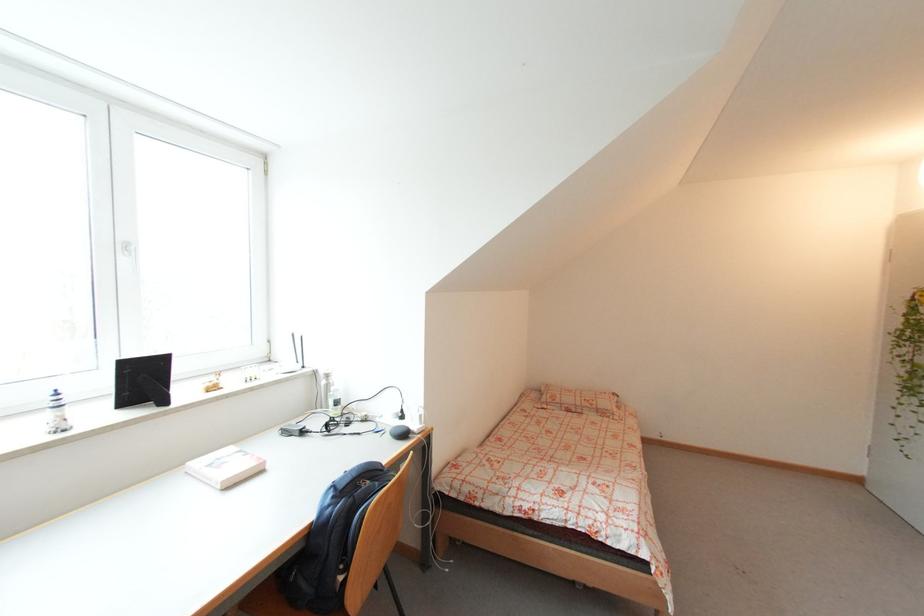
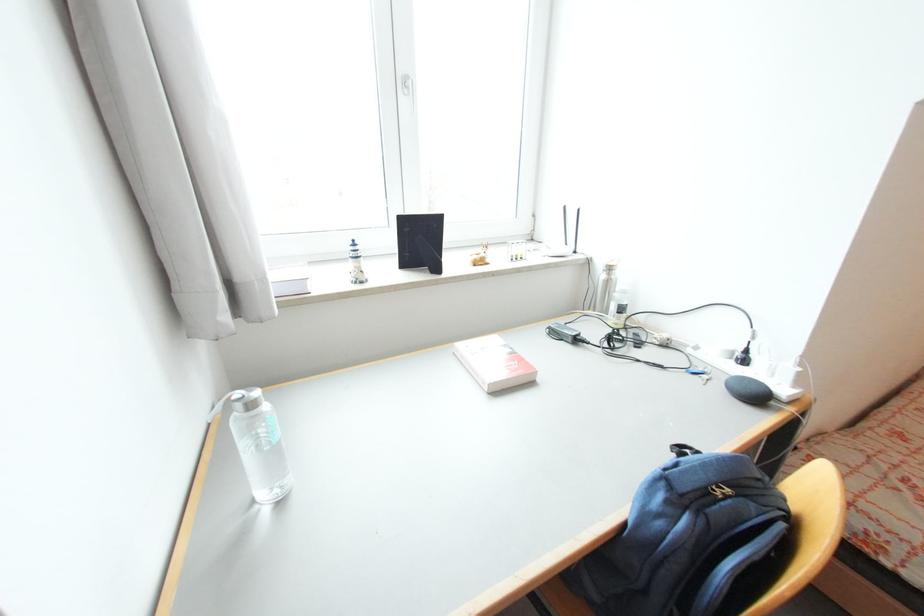
Where in the second image is the point corresponding to the point at 372,483 from the first image?

(734, 492)